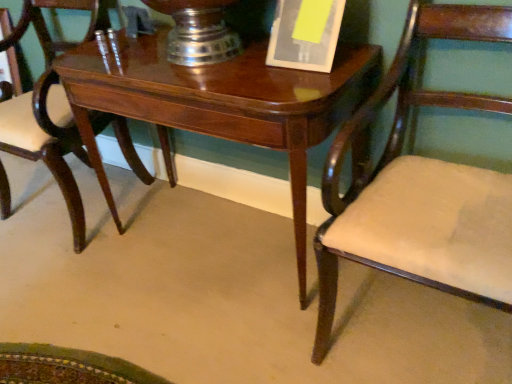
Question: Does yellow paper at upper center come behind matte wood chair at right, arranged as the 2th chair when viewed from the left?

Choices:
 (A) yes
 (B) no

Answer: (A)

Question: Considering the relative sizes of yellow paper at upper center and matte wood chair at right, arranged as the 2th chair when viewed from the left, in the image provided, is yellow paper at upper center smaller than matte wood chair at right, arranged as the 2th chair when viewed from the left,?

Choices:
 (A) yes
 (B) no

Answer: (A)

Question: Is yellow paper at upper center shorter than matte wood chair at right, arranged as the 2th chair when viewed from the left?

Choices:
 (A) no
 (B) yes

Answer: (B)

Question: From the image's perspective, is yellow paper at upper center on matte wood chair at right, arranged as the 2th chair when viewed from the left?

Choices:
 (A) yes
 (B) no

Answer: (A)

Question: From a real-world perspective, is yellow paper at upper center on matte wood chair at right, arranged as the 2th chair when viewed from the left?

Choices:
 (A) no
 (B) yes

Answer: (B)

Question: Does point (370, 180) appear closer or farther from the camera than point (18, 114)?

Choices:
 (A) farther
 (B) closer

Answer: (B)

Question: From their relative heights in the image, would you say matte wood chair at right, which appears as the first chair when viewed from the right, is taller or shorter than mahogany wood chair at center, acting as the second chair starting from the right?

Choices:
 (A) tall
 (B) short

Answer: (A)

Question: From the image's perspective, is matte wood chair at right, arranged as the 2th chair when viewed from the left, located above or below mahogany wood chair at center, marked as the 1th chair in a left-to-right arrangement?

Choices:
 (A) above
 (B) below

Answer: (B)

Question: In the image, is matte wood chair at right, which appears as the first chair when viewed from the right, on the left side or the right side of mahogany wood chair at center, marked as the 1th chair in a left-to-right arrangement?

Choices:
 (A) right
 (B) left

Answer: (A)

Question: Based on their sizes in the image, would you say yellow paper at upper center is bigger or smaller than mahogany wood chair at center, acting as the second chair starting from the right?

Choices:
 (A) small
 (B) big

Answer: (A)

Question: Does point (321, 33) appear closer or farther from the camera than point (62, 102)?

Choices:
 (A) farther
 (B) closer

Answer: (B)

Question: Choose the correct answer: Is yellow paper at upper center inside mahogany wood chair at center, marked as the 1th chair in a left-to-right arrangement, or outside it?

Choices:
 (A) outside
 (B) inside

Answer: (A)

Question: Is yellow paper at upper center wider or thinner than mahogany wood chair at center, marked as the 1th chair in a left-to-right arrangement?

Choices:
 (A) wide
 (B) thin

Answer: (B)

Question: Is glossy wood table at center inside or outside of matte wood chair at right, arranged as the 2th chair when viewed from the left?

Choices:
 (A) outside
 (B) inside

Answer: (A)

Question: In the image, is glossy wood table at center on the left side or the right side of matte wood chair at right, arranged as the 2th chair when viewed from the left?

Choices:
 (A) left
 (B) right

Answer: (A)